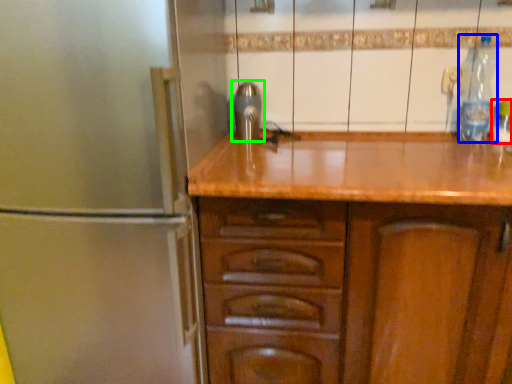
Question: Which is farther away from bottle (highlighted by a red box)? bottle (highlighted by a blue box) or tap (highlighted by a green box)?

Choices:
 (A) bottle
 (B) tap

Answer: (B)